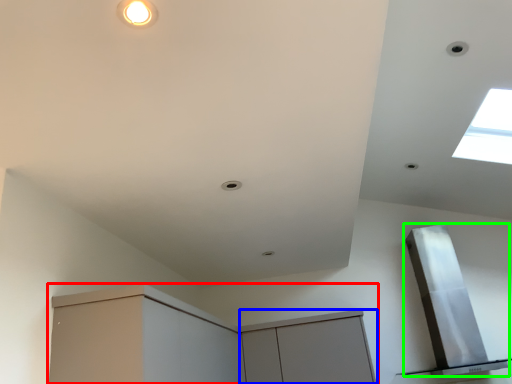
Question: Which object is positioned closest to cabinetry (highlighted by a red box)? Select from cabinetry (highlighted by a blue box) and exhaust hood (highlighted by a green box).

Choices:
 (A) cabinetry
 (B) exhaust hood

Answer: (A)